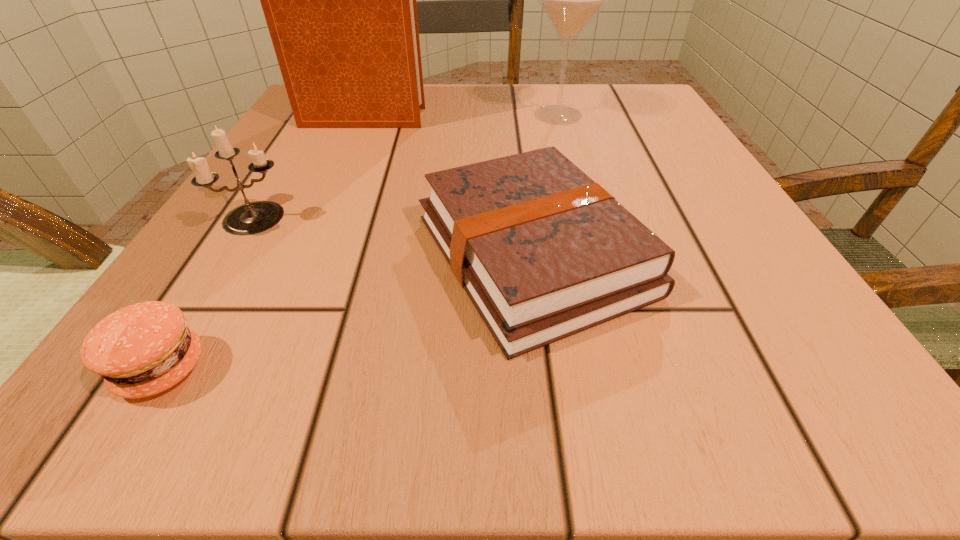
The width and height of the screenshot is (960, 540). I want to click on the farther hardback book, so click(x=339, y=0).

What are the coordinates of `the tallest object` in the screenshot? It's located at (339, 0).

You are a GUI agent. You are given a task and a screenshot of the screen. Output one action in this format:
    pyautogui.click(x=<x>, y=<y>)
    Task: Click on the second tallest object
    The width and height of the screenshot is (960, 540).
    Given the screenshot: What is the action you would take?
    pyautogui.click(x=570, y=0)

Where is `the third tallest object`? the third tallest object is located at coordinates (250, 218).

Locate an element on the screen. the right hardback book is located at coordinates (543, 252).

The height and width of the screenshot is (540, 960). I want to click on the nearer hardback book, so click(x=543, y=252).

Where is `patty`? patty is located at coordinates (143, 349).

The height and width of the screenshot is (540, 960). What are the coordinates of `free space located 0.370m on the open cover of the tallest object` in the screenshot? It's located at click(x=612, y=118).

Find the location of a particular element. Image resolution: width=960 pixels, height=540 pixels. vacant space situated 0.260m on the front of the second tallest object is located at coordinates (588, 213).

Find the location of a particular element. The width and height of the screenshot is (960, 540). vacant area located 0.160m on the right of the candle holder is located at coordinates (404, 217).